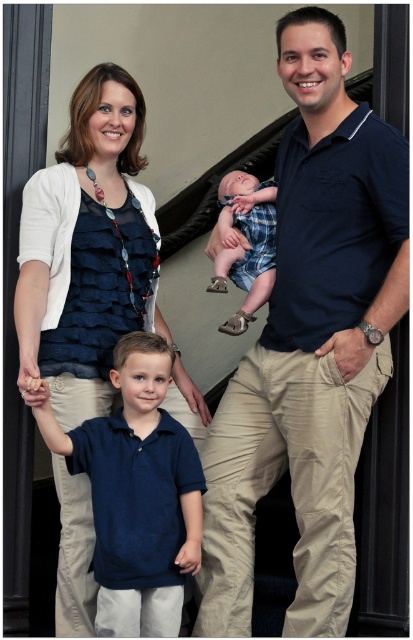
Question: Does matte blue blouse at center appear over matte blue polo shirt at lower left?

Choices:
 (A) no
 (B) yes

Answer: (B)

Question: Which of these objects is positioned closest to the dark blue polo shirt at center?

Choices:
 (A) matte blue polo shirt at lower left
 (B) matte blue blouse at center

Answer: (A)

Question: Can you confirm if matte blue blouse at center is positioned below matte blue polo shirt at lower left?

Choices:
 (A) yes
 (B) no

Answer: (B)

Question: Considering the real-world distances, which object is farthest from the plaid fabric baby at center?

Choices:
 (A) dark blue polo shirt at center
 (B) matte blue blouse at center

Answer: (B)

Question: Where is matte blue blouse at center located in relation to matte blue polo shirt at lower left in the image?

Choices:
 (A) above
 (B) below

Answer: (A)

Question: Which of the following is the farthest from the observer?

Choices:
 (A) (310, 150)
 (B) (251, 220)

Answer: (B)